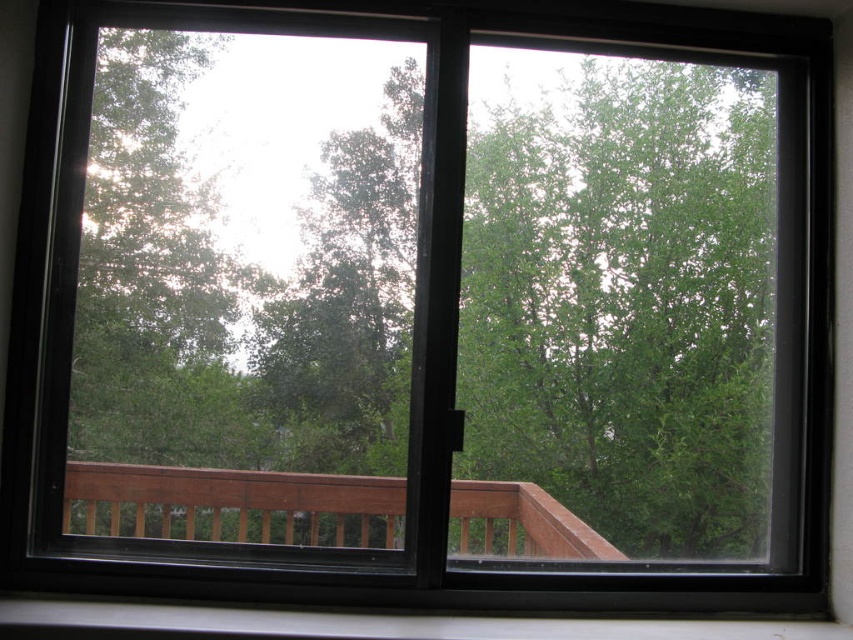
Can you confirm if brown wooden rail at center is positioned below white plastic window sill at lower center?

No.

Which of these two, brown wooden rail at center or white plastic window sill at lower center, stands taller?

With more height is brown wooden rail at center.

I want to click on brown wooden rail at center, so click(x=233, y=493).

The image size is (853, 640). In order to click on brown wooden rail at center in this screenshot , I will do `click(233, 493)`.